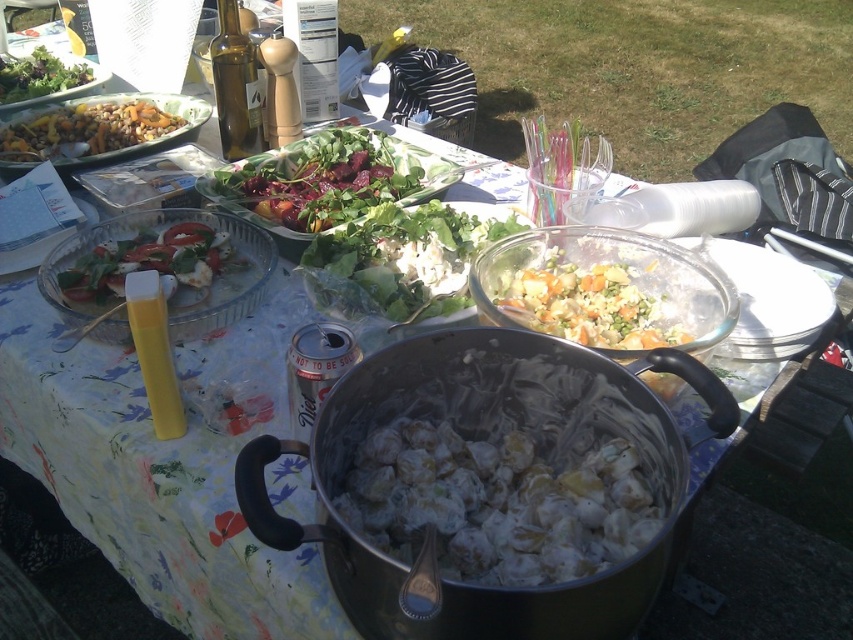
Which of these two, white creamy salad at center or green leafy salad at upper left, stands taller?

green leafy salad at upper left

Is white creamy salad at center to the left of green leafy salad at upper left from the viewer's perspective?

Incorrect, white creamy salad at center is not on the left side of green leafy salad at upper left.

Locate an element on the screen. white creamy salad at center is located at coordinates (509, 474).

Image resolution: width=853 pixels, height=640 pixels. What are the coordinates of `white creamy salad at center` in the screenshot? It's located at (509, 474).

Between green leafymaterial/textureobject at upper center and green leafy salad at upper left, which one appears on the right side from the viewer's perspective?

Positioned to the right is green leafymaterial/textureobject at upper center.

The image size is (853, 640). Find the location of `green leafymaterial/textureobject at upper center`. green leafymaterial/textureobject at upper center is located at coordinates (323, 179).

Consider the image. Is green leafymaterial/textureobject at upper center in front of green leafy salad at center?

That is False.

Can you confirm if green leafymaterial/textureobject at upper center is bigger than green leafy salad at center?

Indeed, green leafymaterial/textureobject at upper center has a larger size compared to green leafy salad at center.

Find the location of a particular element. This screenshot has width=853, height=640. green leafymaterial/textureobject at upper center is located at coordinates (323, 179).

At what (x,y) coordinates should I click in order to perform the action: click on green leafymaterial/textureobject at upper center. Please return your answer as a coordinate pair (x, y). The image size is (853, 640). Looking at the image, I should click on (323, 179).